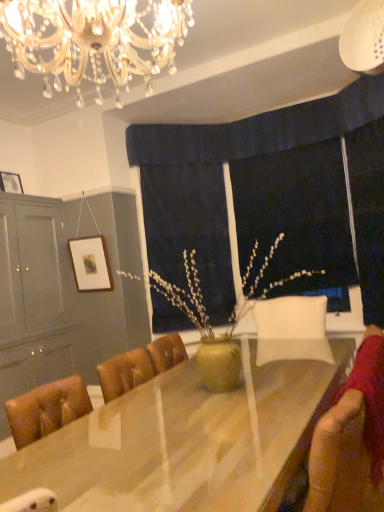
Image resolution: width=384 pixels, height=512 pixels. What do you see at coordinates (10, 182) in the screenshot?
I see `wooden framed picture at upper left, the first picture frame positioned from the left` at bounding box center [10, 182].

Where is `wooden table at center`? wooden table at center is located at coordinates point(186,441).

You are a GUI agent. You are given a task and a screenshot of the screen. Output one action in this format:
    pyautogui.click(x=<x>, y=<y>)
    Task: Click on the crystal glass chandelier at upper center
    
    Given the screenshot: What is the action you would take?
    pyautogui.click(x=93, y=41)

What is the approximate height of dark blue fabric at center?

2.16 meters.

Where is `dark blue fabric at center`? The image size is (384, 512). dark blue fabric at center is located at coordinates (185, 207).

The width and height of the screenshot is (384, 512). What are the coordinates of `wooden framed picture at upper left, which is the 2th picture frame in bottom-to-top order` in the screenshot? It's located at (10, 182).

From a real-world perspective, is matte gray cabinet at left located beneath wooden table at center?

Incorrect, from a real-world perspective, matte gray cabinet at left is higher than wooden table at center.

Is matte gray cabinet at left facing away from wooden table at center?

That's not correct — matte gray cabinet at left is not looking away from wooden table at center.

Does matte gray cabinet at left have a smaller size compared to wooden table at center?

Yes.

From the image's perspective, which is below, matte gray cabinet at left or wooden table at center?

wooden table at center appears lower in the image.

Considering their positions, is wooden picture frame at upper left, acting as the 2th picture frame starting from the top, located in front of or behind wooden framed picture at upper left, acting as the second picture frame starting from the right?

Clearly, wooden picture frame at upper left, acting as the 2th picture frame starting from the top, is in front of wooden framed picture at upper left, acting as the second picture frame starting from the right.

Which is correct: wooden picture frame at upper left, positioned as the 2th picture frame in left-to-right order, is inside wooden framed picture at upper left, which is the first picture frame from top to bottom, or outside of it?

wooden picture frame at upper left, positioned as the 2th picture frame in left-to-right order, is spatially situated outside wooden framed picture at upper left, which is the first picture frame from top to bottom.

Is wooden picture frame at upper left, positioned as the 2th picture frame in left-to-right order, facing away from wooden framed picture at upper left, acting as the second picture frame starting from the right?

wooden picture frame at upper left, positioned as the 2th picture frame in left-to-right order, is not turned away from wooden framed picture at upper left, acting as the second picture frame starting from the right.

Is dark blue fabric at center far away from wooden framed picture at upper left, which is the first picture frame from top to bottom?

dark blue fabric at center is far away from wooden framed picture at upper left, which is the first picture frame from top to bottom.

Is dark blue fabric at center thinner than wooden framed picture at upper left, acting as the second picture frame starting from the right?

In fact, dark blue fabric at center might be wider than wooden framed picture at upper left, acting as the second picture frame starting from the right.

Is dark blue fabric at center situated inside wooden framed picture at upper left, which is the 2th picture frame in bottom-to-top order, or outside?

dark blue fabric at center is outside wooden framed picture at upper left, which is the 2th picture frame in bottom-to-top order.

Considering the sizes of objects matte gray cabinet at left and dark blue fabric at center in the image provided, who is smaller, matte gray cabinet at left or dark blue fabric at center?

dark blue fabric at center.

In the image, there is a matte gray cabinet at left. Where is `curtain above it (from the image's perspective)`? Image resolution: width=384 pixels, height=512 pixels. curtain above it (from the image's perspective) is located at coordinates (185, 207).

From the picture: Could you tell me if matte gray cabinet at left is facing dark blue fabric at center?

No, matte gray cabinet at left is not oriented towards dark blue fabric at center.

Considering the points (126, 313) and (141, 26), which point is in front, point (126, 313) or point (141, 26)?

Positioned in front is point (141, 26).

Considering the sizes of objects matte gray cabinet at left and crystal glass chandelier at upper center in the image provided, who is taller, matte gray cabinet at left or crystal glass chandelier at upper center?

matte gray cabinet at left.

Considering the relative positions of matte gray cabinet at left and crystal glass chandelier at upper center in the image provided, is matte gray cabinet at left to the right of crystal glass chandelier at upper center from the viewer's perspective?

Incorrect, matte gray cabinet at left is not on the right side of crystal glass chandelier at upper center.

Could you tell me if matte gray cabinet at left is turned towards crystal glass chandelier at upper center?

No, matte gray cabinet at left does not turn towards crystal glass chandelier at upper center.

Could you tell me if matte yellow vase at center is turned towards black fabric at center?

No, matte yellow vase at center does not turn towards black fabric at center.

Is matte yellow vase at center located outside black fabric at center?

Yes, matte yellow vase at center is not within black fabric at center.

Where is `window screen above the matte yellow vase at center (from the image's perspective)`? This screenshot has height=512, width=384. window screen above the matte yellow vase at center (from the image's perspective) is located at coordinates (295, 216).

From the image's perspective, between matte yellow vase at center and black fabric at center, who is located below?

matte yellow vase at center appears lower in the image.

From the image's perspective, is wooden table at center above wooden framed picture at upper left, which is the 2th picture frame in bottom-to-top order?

No, from the image's perspective, wooden table at center is not above wooden framed picture at upper left, which is the 2th picture frame in bottom-to-top order.

From a real-world perspective, is wooden table at center physically above wooden framed picture at upper left, the first picture frame positioned from the left?

No, from a real-world perspective, wooden table at center is not on top of wooden framed picture at upper left, the first picture frame positioned from the left.

In the image, is wooden table at center positioned in front of or behind wooden framed picture at upper left, the first picture frame positioned from the left?

Visually, wooden table at center is located in front of wooden framed picture at upper left, the first picture frame positioned from the left.

Would you say wooden table at center is to the left or to the right of wooden framed picture at upper left, which is the first picture frame from top to bottom, in the picture?

In the image, wooden table at center appears on the right side of wooden framed picture at upper left, which is the first picture frame from top to bottom.

Where is `dresser behind the wooden table at center`? The height and width of the screenshot is (512, 384). dresser behind the wooden table at center is located at coordinates (64, 295).

Where is `picture frame in front of the wooden framed picture at upper left, which is the first picture frame from top to bottom`? This screenshot has height=512, width=384. picture frame in front of the wooden framed picture at upper left, which is the first picture frame from top to bottom is located at coordinates (91, 263).

Which object lies further to the anchor point matte yellow vase at center, crystal glass chandelier at upper center or wooden framed picture at upper left, which is the first picture frame from top to bottom?

Among the two, crystal glass chandelier at upper center is located further to matte yellow vase at center.

Which object lies nearer to the anchor point wooden table at center, dark blue fabric at center or matte gray cabinet at left?

Among the two, matte gray cabinet at left is located nearer to wooden table at center.

Estimate the real-world distances between objects in this image. Which object is further from matte yellow vase at center, wooden table at center or velvet brown swivel chair at lower right?

The object further to matte yellow vase at center is velvet brown swivel chair at lower right.

Estimate the real-world distances between objects in this image. Which object is closer to matte gray cabinet at left, velvet brown swivel chair at lower right or wooden table at center?

wooden table at center.

Estimate the real-world distances between objects in this image. Which object is further from crystal glass chandelier at upper center, velvet brown swivel chair at lower right or dark blue fabric at center?

The object further to crystal glass chandelier at upper center is dark blue fabric at center.

Estimate the real-world distances between objects in this image. Which object is closer to velvet brown swivel chair at lower right, wooden framed picture at upper left, which is the first picture frame from top to bottom, or crystal glass chandelier at upper center?

Among the two, crystal glass chandelier at upper center is located nearer to velvet brown swivel chair at lower right.

Estimate the real-world distances between objects in this image. Which object is closer to wooden table at center, velvet brown swivel chair at lower right or dark blue fabric at center?

Among the two, velvet brown swivel chair at lower right is located nearer to wooden table at center.

Which object lies nearer to the anchor point matte gray cabinet at left, matte yellow vase at center or wooden picture frame at upper left, acting as the 2th picture frame starting from the top?

The object closer to matte gray cabinet at left is wooden picture frame at upper left, acting as the 2th picture frame starting from the top.

Locate an element on the screen. The width and height of the screenshot is (384, 512). table located between crystal glass chandelier at upper center and wooden picture frame at upper left, which ranks as the first picture frame in bottom-to-top order, in the depth direction is located at coordinates (186, 441).

Where is `floral arrangement between wooden table at center and matte gray cabinet at left along the z-axis`? Image resolution: width=384 pixels, height=512 pixels. floral arrangement between wooden table at center and matte gray cabinet at left along the z-axis is located at coordinates (209, 322).

The width and height of the screenshot is (384, 512). In order to click on curtain between matte gray cabinet at left and black fabric at center in this screenshot , I will do `click(185, 207)`.

Locate an element on the screen. Image resolution: width=384 pixels, height=512 pixels. curtain located between wooden picture frame at upper left, positioned as the 2th picture frame in left-to-right order, and black fabric at center in the left-right direction is located at coordinates (185, 207).